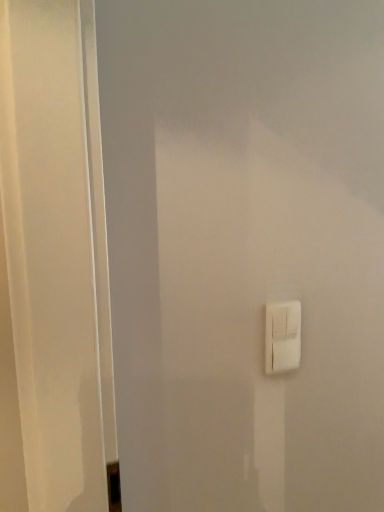
At what (x,y) coordinates should I click in order to perform the action: click on white plastic light switch at center-right. Please return your answer as a coordinate pair (x, y). Image resolution: width=384 pixels, height=512 pixels. Looking at the image, I should click on (282, 337).

In order to face white plastic light switch at center-right, should I rotate leftwards or rightwards?

Turn right approximately 12.735 degrees to face it.

What do you see at coordinates (282, 337) in the screenshot? This screenshot has height=512, width=384. I see `white plastic light switch at center-right` at bounding box center [282, 337].

Image resolution: width=384 pixels, height=512 pixels. Find the location of `white plastic light switch at center-right`. white plastic light switch at center-right is located at coordinates (282, 337).